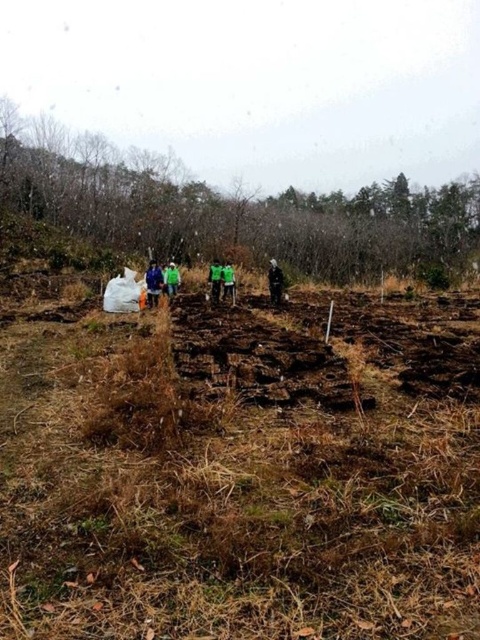
Question: Which point is farther to the camera?

Choices:
 (A) pyautogui.click(x=228, y=275)
 (B) pyautogui.click(x=213, y=285)
 (C) pyautogui.click(x=172, y=268)
 (D) pyautogui.click(x=36, y=173)

Answer: (D)

Question: Which point is farther to the camera?

Choices:
 (A) brown soil at center
 (B) green fabric at center

Answer: (B)

Question: Does brown soil at center have a lesser width compared to brown rough tree at upper center?

Choices:
 (A) no
 (B) yes

Answer: (B)

Question: Which of the following is the farthest from the observer?

Choices:
 (A) brown soil at center
 (B) brown rough tree at upper center
 (C) blue fabric jacket at center

Answer: (B)

Question: Can you confirm if brown soil at center is positioned below blue fabric jacket at center?

Choices:
 (A) no
 (B) yes

Answer: (B)

Question: Is blue fabric jacket at center smaller than black matte jacket at center?

Choices:
 (A) no
 (B) yes

Answer: (A)